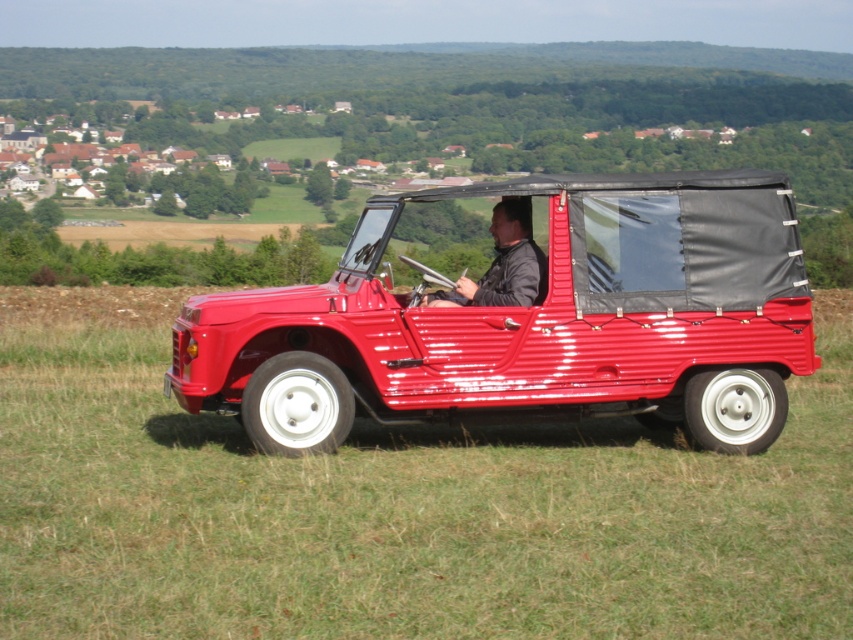
Which is more to the right, glossy red jeep at center or leather jacket at center?

From the viewer's perspective, leather jacket at center appears more on the right side.

Is glossy red jeep at center below leather jacket at center?

Yes.

Who is more forward, (664, 323) or (496, 227)?

Point (664, 323) is more forward.

Where is `glossy red jeep at center`? The image size is (853, 640). glossy red jeep at center is located at coordinates (531, 321).

Between glossy grass at center and leather jacket at center, which one is positioned higher?

leather jacket at center

Is point (192, 577) in front of point (492, 268)?

That is True.

Identify the location of glossy grass at center. (403, 515).

Between glossy grass at center and glossy red jeep at center, which one has less height?

glossy grass at center

Is glossy grass at center below glossy red jeep at center?

Correct, glossy grass at center is located below glossy red jeep at center.

Is point (457, 586) less distant than point (657, 221)?

Yes, it is.

The width and height of the screenshot is (853, 640). Find the location of `glossy grass at center`. glossy grass at center is located at coordinates (403, 515).